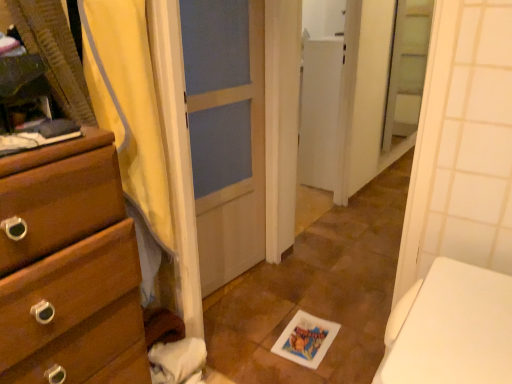
Locate an element on the screen. This screenshot has width=512, height=384. blank space situated above yellow fabric shower curtain at left (from a real-world perspective) is located at coordinates (110, 0).